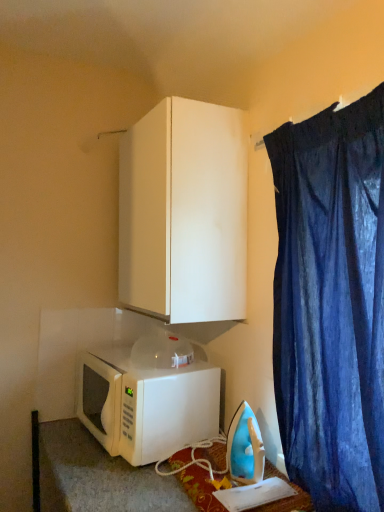
Question: Considering the relative sizes of white matte microwave at lower left and blue plastic iron at lower right in the image provided, is white matte microwave at lower left smaller than blue plastic iron at lower right?

Choices:
 (A) yes
 (B) no

Answer: (B)

Question: Is white matte microwave at lower left outside of blue plastic iron at lower right?

Choices:
 (A) yes
 (B) no

Answer: (A)

Question: Is white matte microwave at lower left facing away from blue plastic iron at lower right?

Choices:
 (A) yes
 (B) no

Answer: (B)

Question: Could you tell me if white matte microwave at lower left is facing blue plastic iron at lower right?

Choices:
 (A) yes
 (B) no

Answer: (B)

Question: From a real-world perspective, is white matte microwave at lower left positioned over blue plastic iron at lower right based on gravity?

Choices:
 (A) no
 (B) yes

Answer: (B)

Question: In the image, is dark blue fabric at upper right positioned in front of or behind white matte microwave at lower left?

Choices:
 (A) behind
 (B) front

Answer: (B)

Question: From their relative heights in the image, would you say dark blue fabric at upper right is taller or shorter than white matte microwave at lower left?

Choices:
 (A) tall
 (B) short

Answer: (A)

Question: From the image's perspective, is dark blue fabric at upper right above or below white matte microwave at lower left?

Choices:
 (A) below
 (B) above

Answer: (B)

Question: From a real-world perspective, is dark blue fabric at upper right above or below white matte microwave at lower left?

Choices:
 (A) below
 (B) above

Answer: (B)

Question: Would you say white matte microwave at lower left is inside or outside white matte cabinet at upper center?

Choices:
 (A) inside
 (B) outside

Answer: (B)

Question: Considering the relative positions of white matte microwave at lower left and white matte cabinet at upper center in the image provided, is white matte microwave at lower left to the left or to the right of white matte cabinet at upper center?

Choices:
 (A) right
 (B) left

Answer: (B)

Question: From the image's perspective, relative to white matte cabinet at upper center, is white matte microwave at lower left above or below?

Choices:
 (A) below
 (B) above

Answer: (A)

Question: Is white matte microwave at lower left in front of or behind white matte cabinet at upper center in the image?

Choices:
 (A) behind
 (B) front

Answer: (B)

Question: Considering the positions of white matte cabinet at upper center and blue plastic iron at lower right in the image, is white matte cabinet at upper center taller or shorter than blue plastic iron at lower right?

Choices:
 (A) short
 (B) tall

Answer: (B)

Question: From the image's perspective, relative to blue plastic iron at lower right, is white matte cabinet at upper center above or below?

Choices:
 (A) below
 (B) above

Answer: (B)